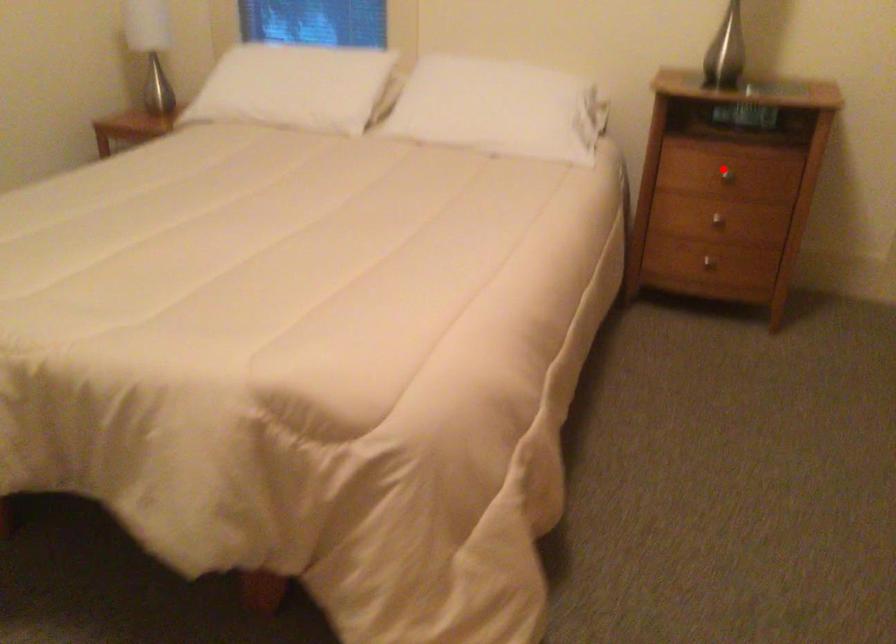
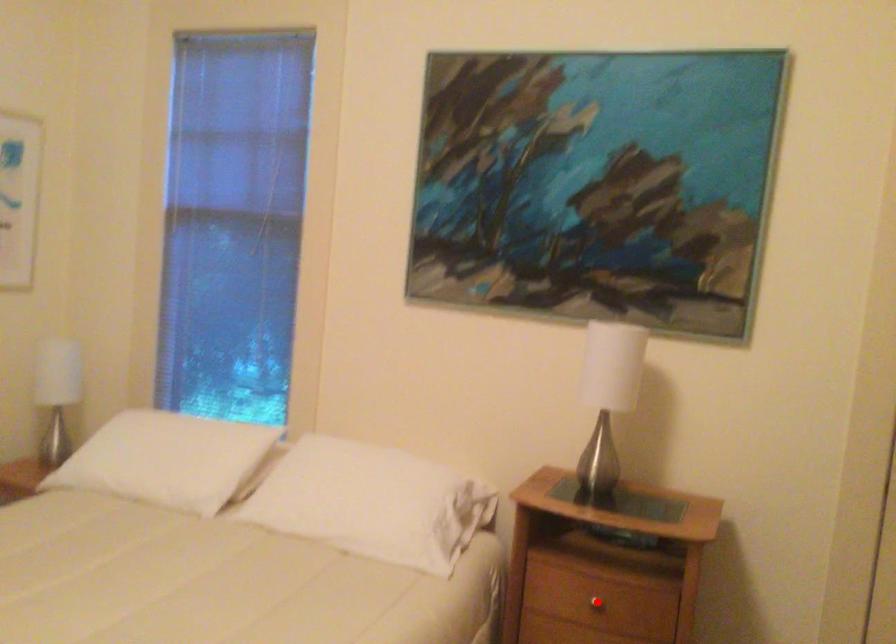
I am providing you with two images of the same scene from different viewpoints. A red point is marked on the first image and another point is marked on the second image. Does the point marked in image1 correspond to the same location as the one in image2?

Yes